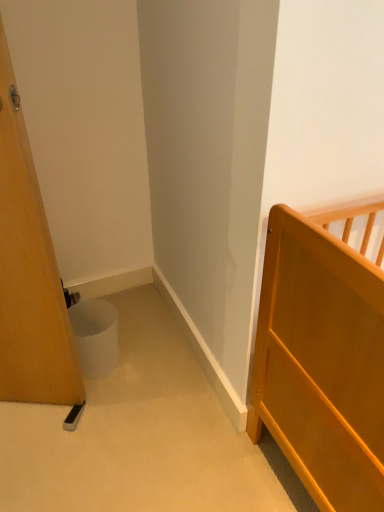
What are the coordinates of `white matte potty at lower left` in the screenshot? It's located at (95, 336).

In order to face white matte potty at lower left, should I rotate leftwards or rightwards?

A 13.555 degree turn to the left will do.

What do you see at coordinates (95, 336) in the screenshot? This screenshot has height=512, width=384. I see `white matte potty at lower left` at bounding box center [95, 336].

I want to click on white matte potty at lower left, so click(x=95, y=336).